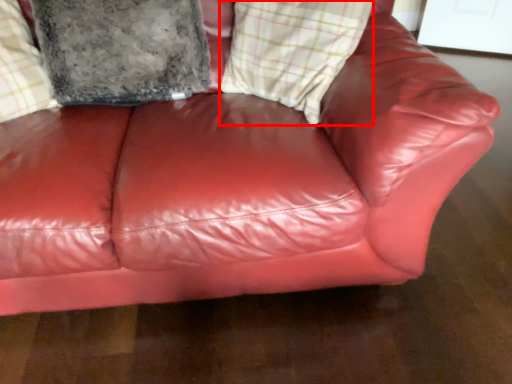
Question: From the image's perspective, considering the relative positions of plaid (annotated by the red box) and pillow in the image provided, where is plaid (annotated by the red box) located with respect to the staircase?

Choices:
 (A) below
 (B) above

Answer: (A)